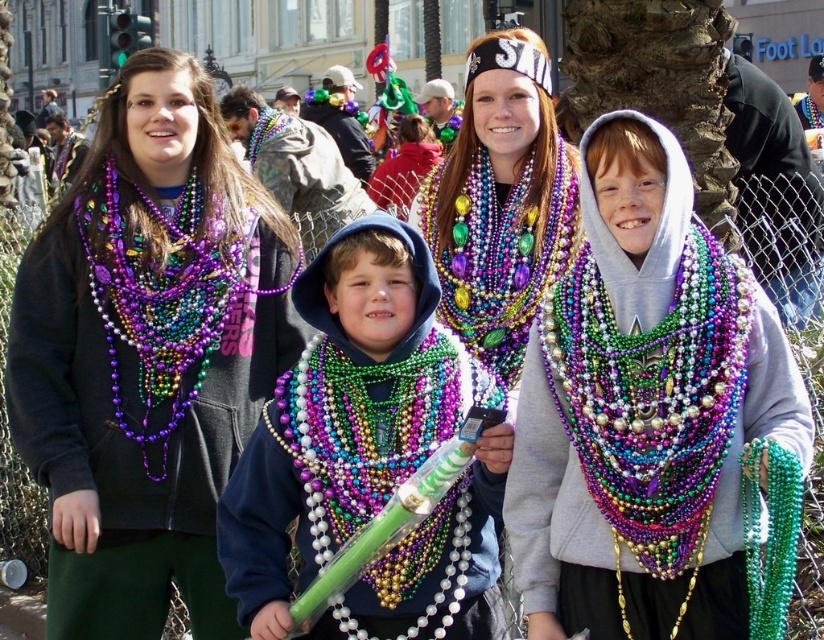
The image size is (824, 640). Describe the element at coordinates (653, 417) in the screenshot. I see `multicolored beaded necklace at center` at that location.

Is point (743, 349) positioned before point (366, 397)?

That is True.

What do you see at coordinates (653, 417) in the screenshot?
I see `multicolored beaded necklace at center` at bounding box center [653, 417].

The image size is (824, 640). In order to click on multicolored beaded necklace at center in this screenshot , I will do `click(653, 417)`.

Is purple matte beads at left bigger than multicolored beads necklace at center?

No, purple matte beads at left is not bigger than multicolored beads necklace at center.

In the scene shown: Between purple matte beads at left and multicolored beads necklace at center, which one has more height?

purple matte beads at left

Who is more forward, (73, 305) or (386, 182)?

Point (73, 305) is more forward.

At what (x,y) coordinates should I click in order to perform the action: click on purple matte beads at left. Please return your answer as a coordinate pair (x, y). This screenshot has height=640, width=824. Looking at the image, I should click on (147, 355).

Measure the distance from shiny plastic baton at center to multicolored beads at center.

shiny plastic baton at center and multicolored beads at center are 5.05 meters apart.

Is shiny plastic baton at center to the left of multicolored beads at center from the viewer's perspective?

Correct, you'll find shiny plastic baton at center to the left of multicolored beads at center.

Is point (265, 420) less distant than point (520, 333)?

Yes.

At what (x,y) coordinates should I click in order to perform the action: click on shiny plastic baton at center. Please return your answer as a coordinate pair (x, y). Looking at the image, I should click on (344, 413).